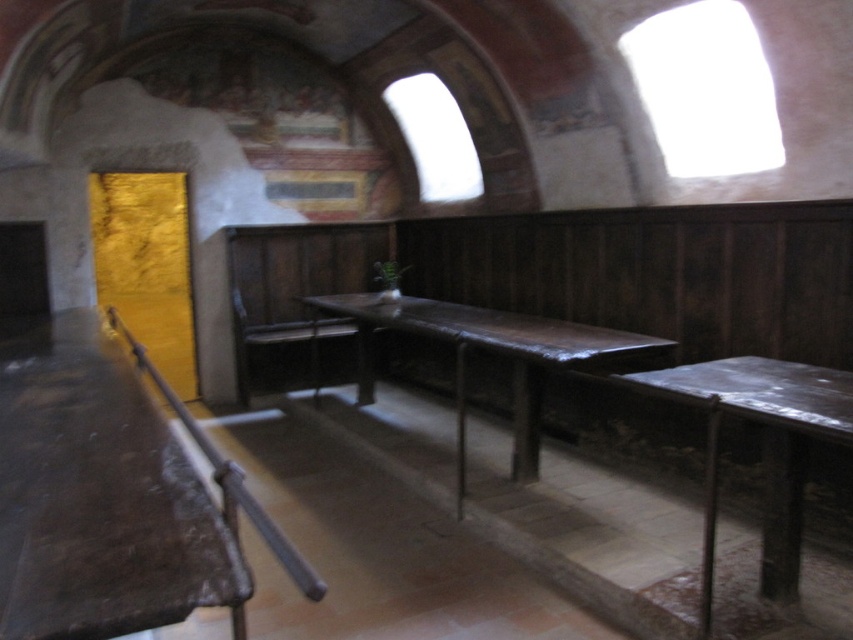
Between point (793, 368) and point (619, 344), which one is positioned in front?

Point (793, 368) is in front.

Who is more distant from viewer, (813, 396) or (579, 355)?

Point (579, 355)

Identify the location of rustic wood table at lower right. (770, 436).

Does dark brown wooden table at left appear under rustic wood table at center?

Yes.

Does point (131, 508) come farther from viewer compared to point (589, 328)?

No, (131, 508) is closer to viewer.

Is point (13, 525) in front of point (515, 440)?

Yes, it is in front of point (515, 440).

Locate an element on the screen. The width and height of the screenshot is (853, 640). dark brown wooden table at left is located at coordinates (100, 499).

In the scene shown: Can you confirm if dark brown wooden table at left is thinner than rustic wood table at lower right?

Incorrect, dark brown wooden table at left's width is not less than rustic wood table at lower right's.

Between point (36, 580) and point (683, 368), which one is positioned in front?

Positioned in front is point (36, 580).

Where is `dark brown wooden table at left`? The image size is (853, 640). dark brown wooden table at left is located at coordinates (100, 499).